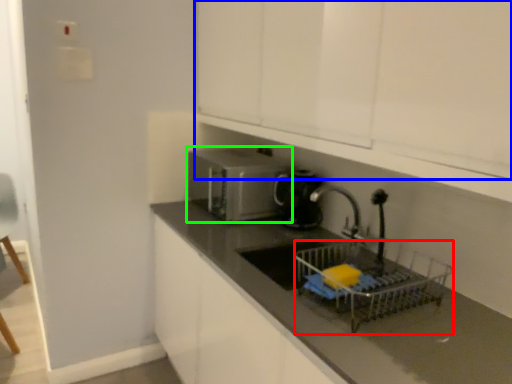
Question: Which object is the closest to the basket (highlighted by a red box)? Choose among these: cabinetry (highlighted by a blue box) or home appliance (highlighted by a green box).

Choices:
 (A) cabinetry
 (B) home appliance

Answer: (A)